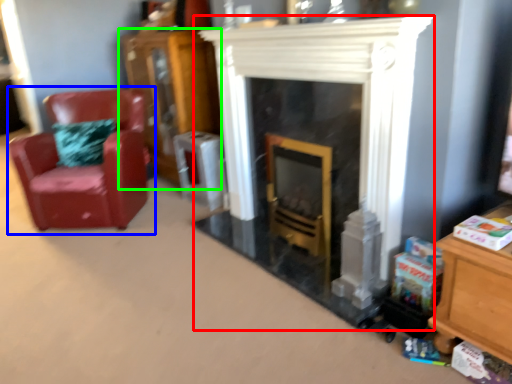
Question: Estimate the real-world distances between objects in this image. Which object is closer to fireplace (highlighted by a red box), chair (highlighted by a blue box) or dresser (highlighted by a green box)?

Choices:
 (A) chair
 (B) dresser

Answer: (A)